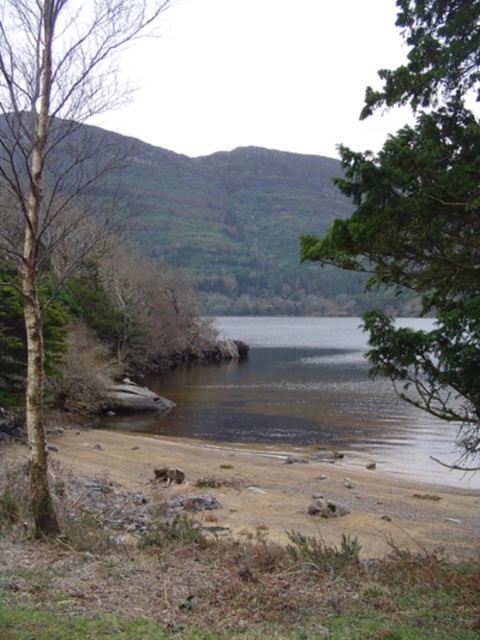
You are standing on the lakeside and want to walk from the bare bark tree at left to the brown smooth water at lower center. Which direction should you head?

You should head to the right because the bare bark tree at left is to the left of the brown smooth water at lower center, so moving right will take you towards it.

You are an environmental scientist examining this lakeside area. You need to determine which object occupies a greater area in the image between the green leafy tree at upper right and the brown sand at lower left. Based on the scene description, which one is larger?

The green leafy tree at upper right has a larger size compared to the brown sand at lower left, so the green leafy tree at upper right occupies a greater area in the image.

You are standing at the lakeside and want to take a photo of the green leafy tree at upper right. If your camera has a maximum zoom range of 5 meters, will you be able to capture the tree clearly without moving closer?

The green leafy tree at upper right is 7.54 meters away from the viewer. Since the camera can only zoom up to 5 meters, you won cannot capture it clearly without moving closer.